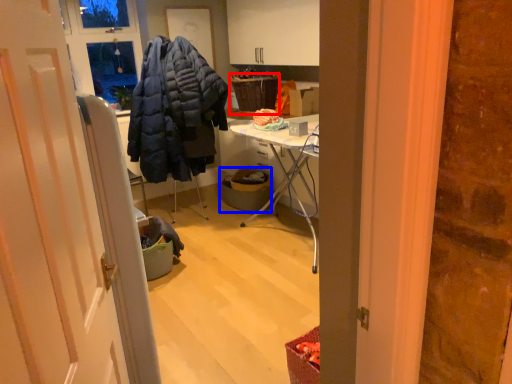
Question: Which object is closer to the camera taking this photo, picnic basket (highlighted by a red box) or trash bin/can (highlighted by a blue box)?

Choices:
 (A) picnic basket
 (B) trash bin/can

Answer: (B)